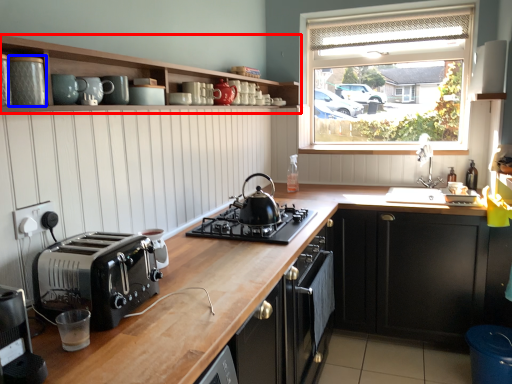
Question: Which of the following is the farthest to the observer, cabinetry (highlighted by a red box) or appliance (highlighted by a blue box)?

Choices:
 (A) cabinetry
 (B) appliance

Answer: (B)